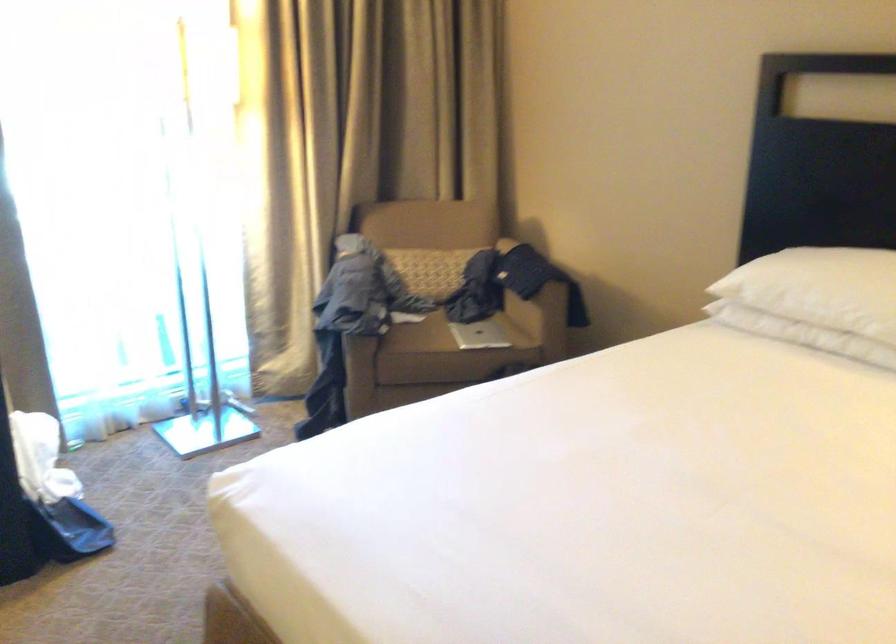
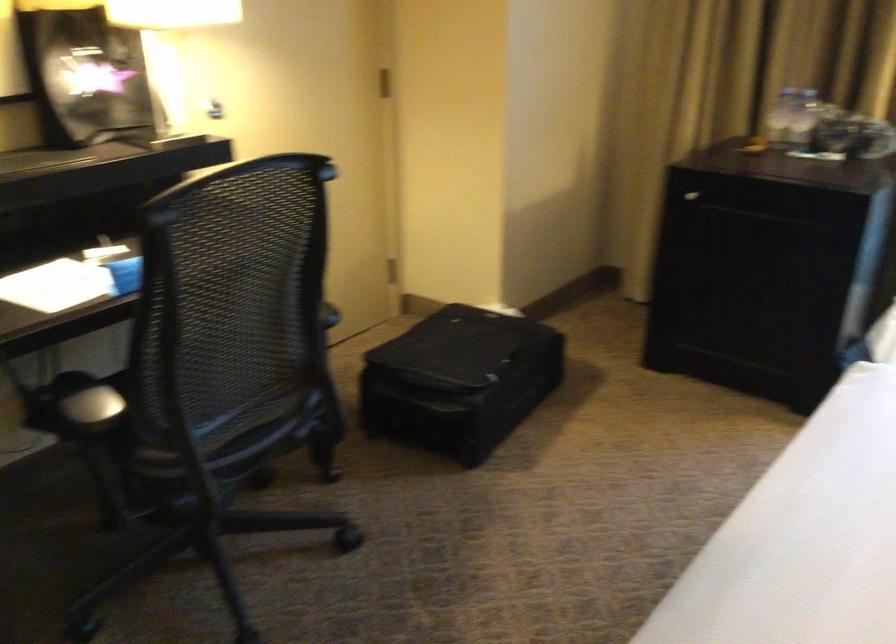
How did the camera likely rotate?

The camera rotated toward left-down.